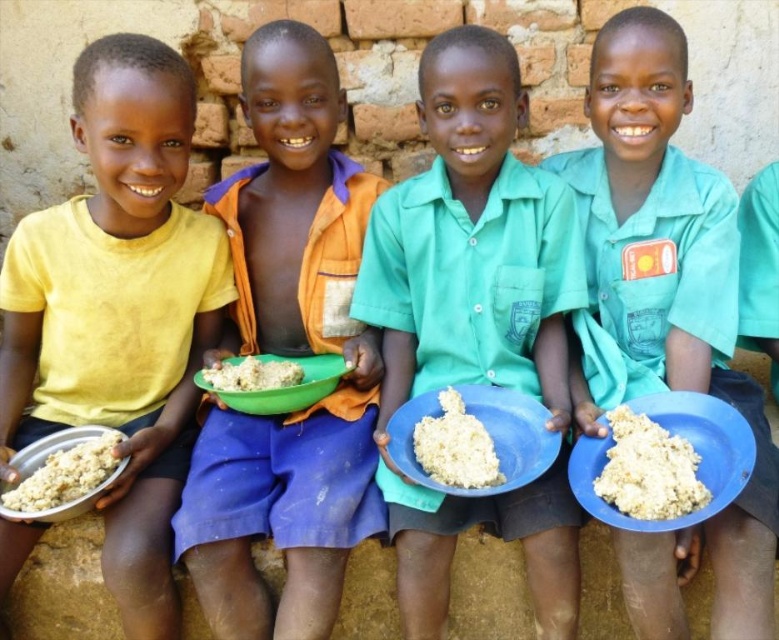
You are a chef preparing a dish and need to choose between the green matte bowl at center and the white crumbly food at center. Which one is taller?

The green matte bowl at center is much taller than the white crumbly food at center.

From the picture: You are standing in front of the brick wall where the boys are sitting. You want to place a small object on the ground between the yellow matte shirt at left and the matte metallic bowl at lower left. Will the object be closer to the shirt or the bowl?

The yellow matte shirt at left is further to the viewer than the matte metallic bowl at lower left, so the object placed between them will be closer to the bowl.